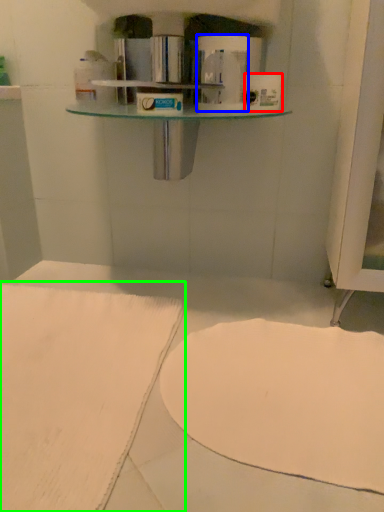
Question: Based on their relative distances, which object is nearer to toilet paper (highlighted by a red box)? Choose from toilet paper (highlighted by a blue box) and sheet (highlighted by a green box).

Choices:
 (A) toilet paper
 (B) sheet

Answer: (A)